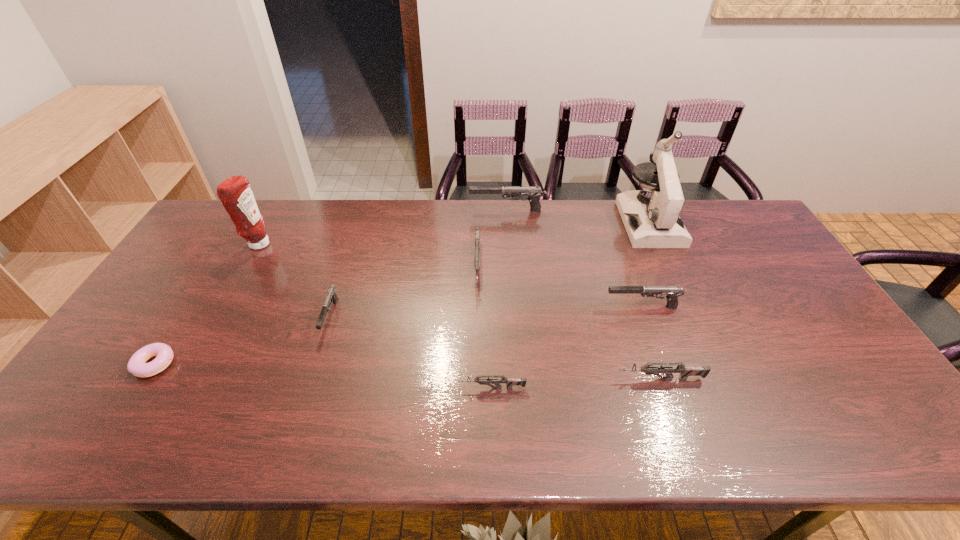
What are the coordinates of `free spot located aimed along the barrel of the nearest grey gun` in the screenshot? It's located at (434, 388).

Find the location of a particular element. vacant space located 0.300m on the right of the doughnut is located at coordinates (292, 364).

The width and height of the screenshot is (960, 540). I want to click on microscope located in the far edge section of the desktop, so click(651, 218).

I want to click on condiment that is at the far edge, so click(x=235, y=193).

Where is `object positioned at the left edge`? This screenshot has width=960, height=540. object positioned at the left edge is located at coordinates (137, 365).

In the image, there is a desktop. Where is `free space at the far edge`? free space at the far edge is located at coordinates (336, 202).

Find the location of a particular element. vacant space at the near edge is located at coordinates (767, 415).

Locate an element on the screen. Image resolution: width=960 pixels, height=540 pixels. vacant region at the right edge is located at coordinates (804, 335).

The height and width of the screenshot is (540, 960). In the image, there is a desktop. What are the coordinates of `free space at the near left corner` in the screenshot? It's located at (50, 437).

The image size is (960, 540). I want to click on vacant area that lies between the tallest object and the second biggest grey gun, so click(x=655, y=301).